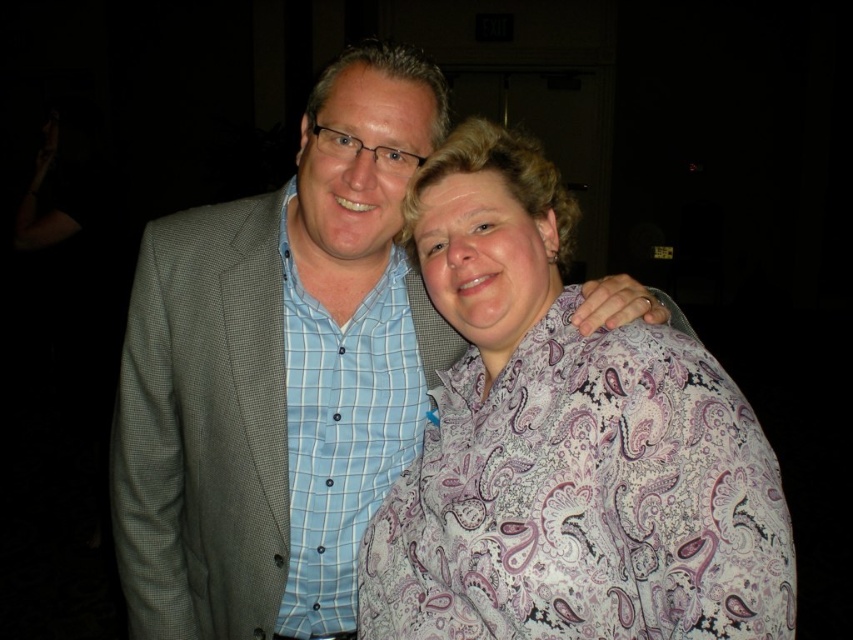
Question: Which of the following is the closest to the observer?

Choices:
 (A) light blue checkered shirt at center
 (B) paisley-patterned blouse at center
 (C) light gray textured blazer at center

Answer: (B)

Question: In this image, where is light gray textured blazer at center located relative to light blue checkered shirt at center?

Choices:
 (A) right
 (B) left

Answer: (B)

Question: Which point is farther from the camera taking this photo?

Choices:
 (A) (677, 419)
 (B) (398, 330)

Answer: (B)

Question: Considering the real-world distances, which object is farthest from the light blue checkered shirt at center?

Choices:
 (A) light gray textured blazer at center
 (B) paisley-patterned blouse at center

Answer: (B)

Question: Does paisley-patterned blouse at center appear under light blue checkered shirt at center?

Choices:
 (A) no
 (B) yes

Answer: (A)

Question: Can you confirm if light gray textured blazer at center is positioned to the right of paisley-patterned blouse at center?

Choices:
 (A) no
 (B) yes

Answer: (A)